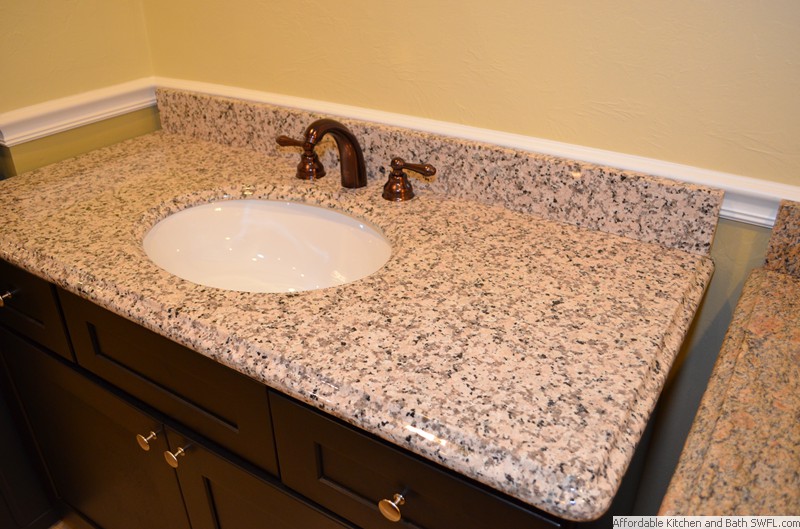
Identify the location of cold water handle. The image size is (800, 529). (422, 168).